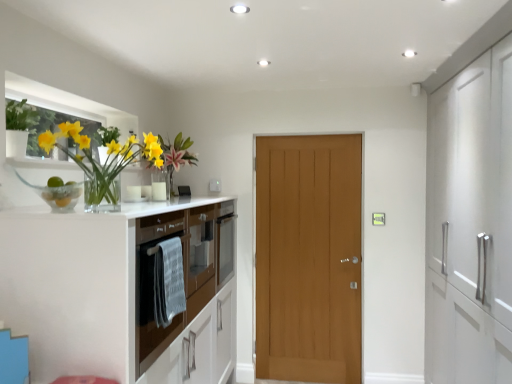
The height and width of the screenshot is (384, 512). Find the location of `vacant space situated above light brown wood door at center (from a real-world perspective)`. vacant space situated above light brown wood door at center (from a real-world perspective) is located at coordinates (302, 134).